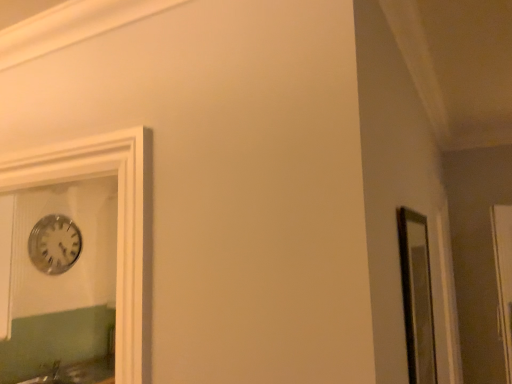
Question: Considering the relative positions of transparent glass door at right and silver metallic clock at upper left in the image provided, is transparent glass door at right to the left or to the right of silver metallic clock at upper left?

Choices:
 (A) left
 (B) right

Answer: (B)

Question: Is point (497, 243) closer or farther from the camera than point (71, 246)?

Choices:
 (A) closer
 (B) farther

Answer: (A)

Question: Estimate the real-world distances between objects in this image. Which object is farther from the transparent glass door at right?

Choices:
 (A) matte glass mirror at right
 (B) silver metallic clock at upper left

Answer: (B)

Question: Based on their relative distances, which object is nearer to the transparent glass door at right?

Choices:
 (A) silver metallic clock at upper left
 (B) matte glass mirror at right

Answer: (B)